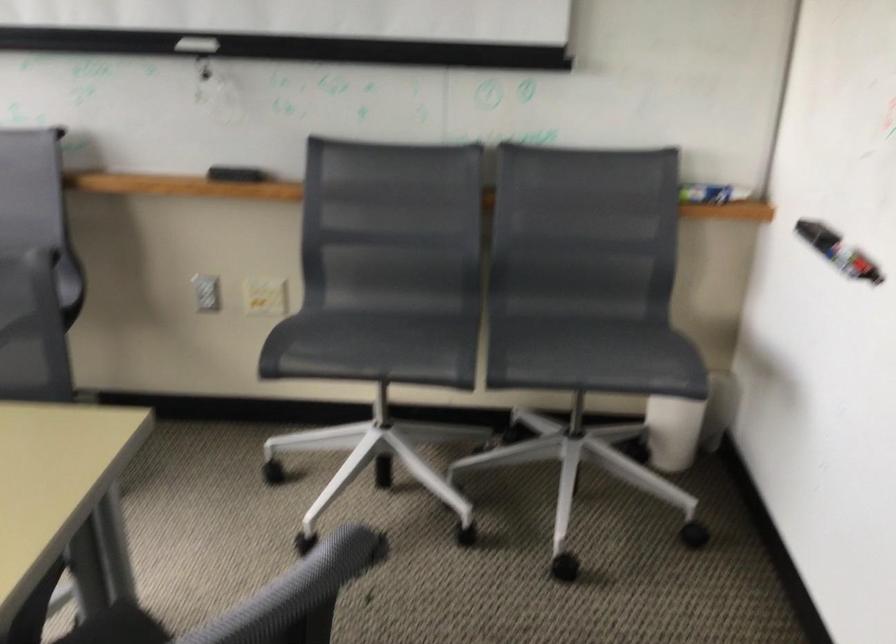
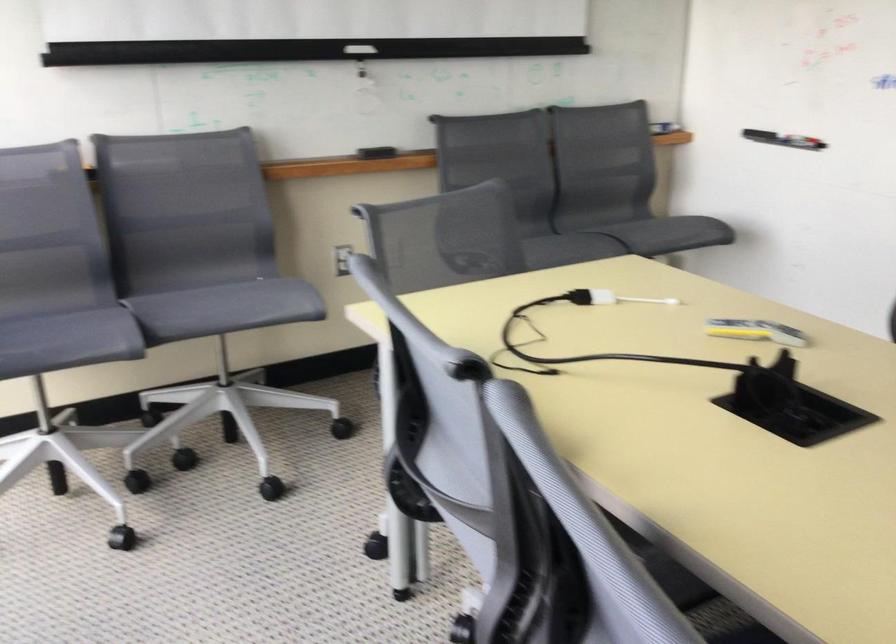
Find the pixel in the second image that matches (694,333) in the first image.

(657, 223)